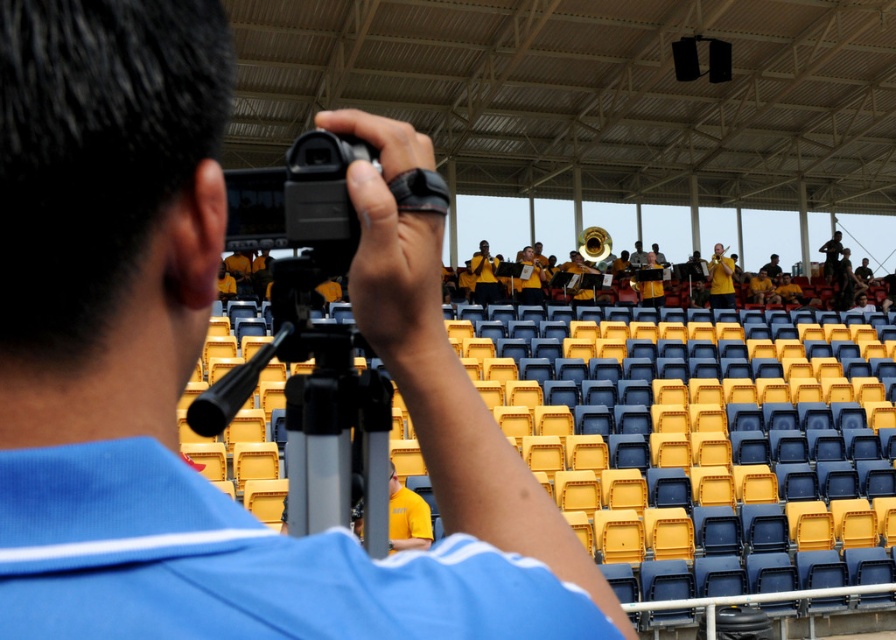
Question: Which point is closer to the camera?

Choices:
 (A) black plastic tripod at center
 (B) yellow matte uniform at center

Answer: (A)

Question: In this image, where is black plastic tripod at center located relative to yellow matte uniform at center?

Choices:
 (A) right
 (B) left

Answer: (B)

Question: Is black plastic tripod at center further to the viewer compared to yellow matte uniform at center?

Choices:
 (A) no
 (B) yes

Answer: (A)

Question: Among these objects, which one is nearest to the camera?

Choices:
 (A) yellow matte uniform at center
 (B) black plastic tripod at center

Answer: (B)

Question: Does black plastic tripod at center lie behind yellow matte uniform at center?

Choices:
 (A) no
 (B) yes

Answer: (A)